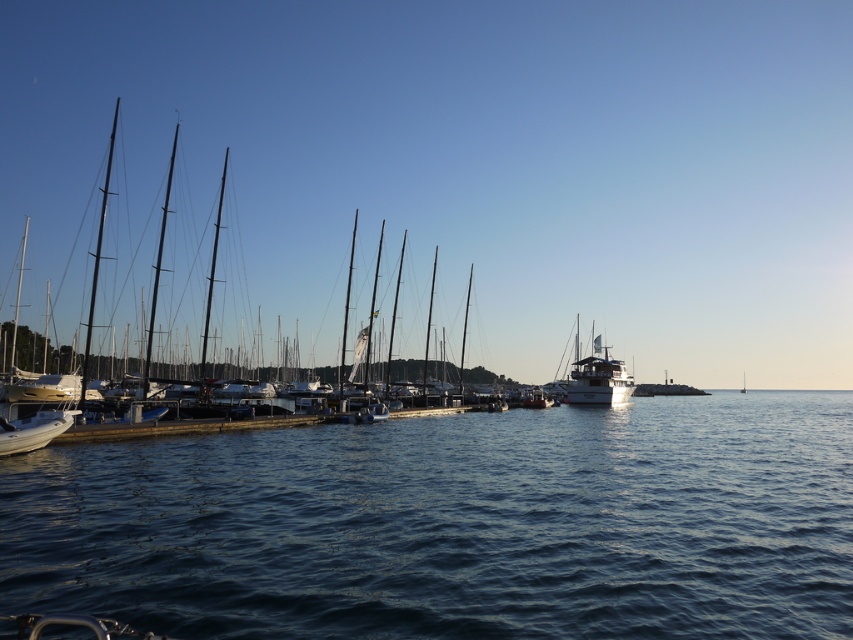
Is point (517, 588) positioned behind point (741, 390)?

No, it is not.

Does blue water at center lie in front of white glossy sailboat at center?

Yes.

Image resolution: width=853 pixels, height=640 pixels. I want to click on blue water at center, so click(454, 524).

Is white glossy yacht at center bigger than white glossy sailboat at center?

Indeed, white glossy yacht at center has a larger size compared to white glossy sailboat at center.

Can you confirm if white glossy yacht at center is positioned above white glossy sailboat at center?

Correct, white glossy yacht at center is located above white glossy sailboat at center.

Is point (585, 381) closer to viewer compared to point (741, 380)?

Yes, point (585, 381) is in front of point (741, 380).

The width and height of the screenshot is (853, 640). Identify the location of white glossy yacht at center. (598, 380).

Can you confirm if white glossy yacht at center is taller than white glossy boat at lower left?

Yes.

The image size is (853, 640). I want to click on white glossy yacht at center, so click(x=598, y=380).

In order to click on white glossy yacht at center in this screenshot , I will do `click(598, 380)`.